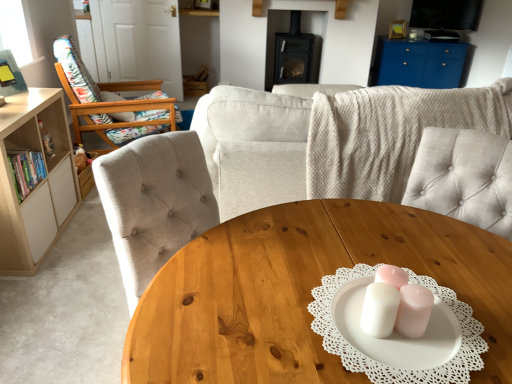
Question: In terms of size, does wooden floral-patterned chair at left appear bigger or smaller than blue glossy cabinet at upper right?

Choices:
 (A) small
 (B) big

Answer: (B)

Question: In terms of height, does wooden floral-patterned chair at left look taller or shorter compared to blue glossy cabinet at upper right?

Choices:
 (A) short
 (B) tall

Answer: (B)

Question: Which is farther from the wooden coffee table at center?

Choices:
 (A) blue glossy cabinet at upper right
 (B) flat screen tv at upper right
 (C) black matte fireplace at center
 (D) wooden floral-patterned chair at left
 (E) beige fabric couch at center

Answer: (B)

Question: Estimate the real-world distances between objects in this image. Which object is farther from the wooden floral-patterned chair at left?

Choices:
 (A) wooden coffee table at center
 (B) beige fabric couch at center
 (C) blue glossy cabinet at upper right
 (D) light beige wood bookshelf at left
 (E) black matte fireplace at center

Answer: (C)